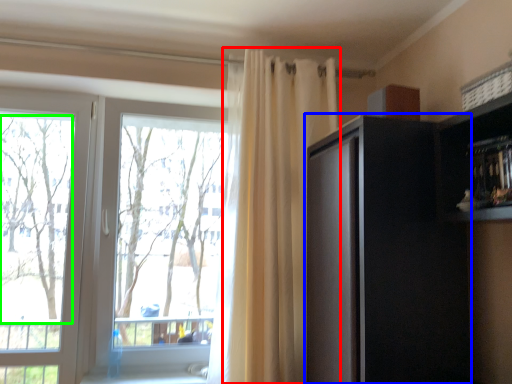
Question: Considering the real-world distances, which object is farthest from curtain (highlighted by a red box)? cabinetry (highlighted by a blue box) or tree (highlighted by a green box)?

Choices:
 (A) cabinetry
 (B) tree

Answer: (B)